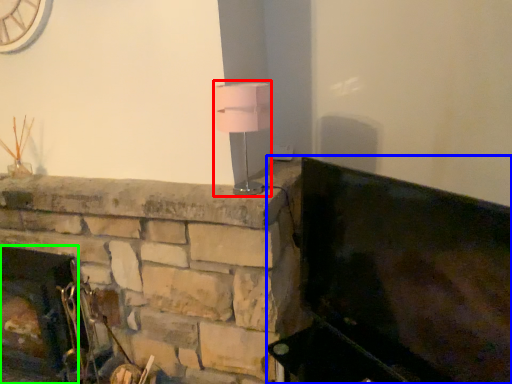
Question: Based on their relative distances, which object is farther from table lamp (highlighted by a red box)? Choose from furniture (highlighted by a blue box) and fireplace (highlighted by a green box).

Choices:
 (A) furniture
 (B) fireplace

Answer: (B)